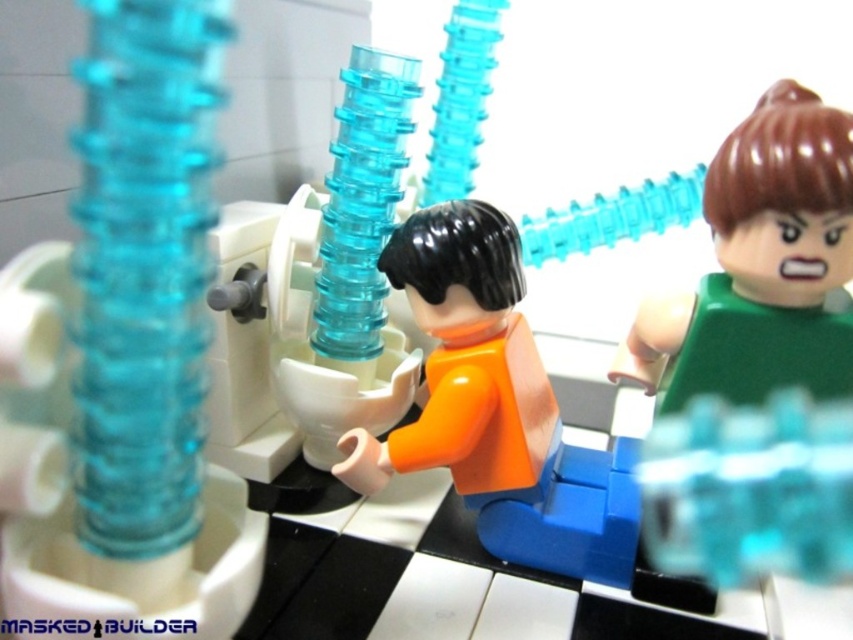
Question: Is transparent blue tube at center positioned before orange matte figure at center?

Choices:
 (A) no
 (B) yes

Answer: (B)

Question: Can you confirm if transparent blue tube at center is bigger than orange matte figure at center?

Choices:
 (A) no
 (B) yes

Answer: (A)

Question: Is transparent blue tube at center positioned behind orange matte figure at center?

Choices:
 (A) no
 (B) yes

Answer: (A)

Question: Which of the following is the closest to the observer?

Choices:
 (A) orange matte figure at center
 (B) transparent blue tube at center

Answer: (B)